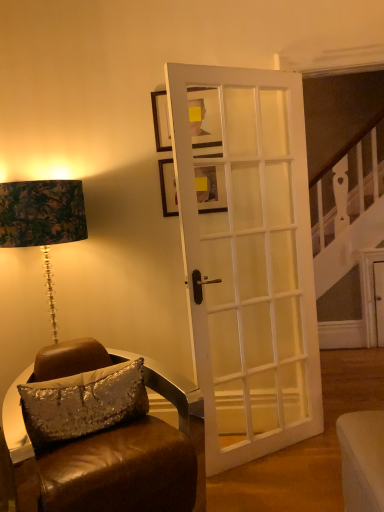
Question: Is matte black picture frame at upper center, placed as the second picture frame when sorted from bottom to top, surrounding brown leather chair at lower left?

Choices:
 (A) yes
 (B) no

Answer: (B)

Question: From the image's perspective, is matte black picture frame at upper center, marked as the first picture frame in a top-to-bottom arrangement, on top of brown leather chair at lower left?

Choices:
 (A) no
 (B) yes

Answer: (B)

Question: Is matte black picture frame at upper center, placed as the second picture frame when sorted from bottom to top, behind brown leather chair at lower left?

Choices:
 (A) no
 (B) yes

Answer: (B)

Question: Is matte black picture frame at upper center, placed as the second picture frame when sorted from bottom to top, in front of brown leather chair at lower left?

Choices:
 (A) no
 (B) yes

Answer: (A)

Question: Can you see matte black picture frame at upper center, marked as the first picture frame in a top-to-bottom arrangement, touching brown leather chair at lower left?

Choices:
 (A) no
 (B) yes

Answer: (A)

Question: Considering their positions, is matte black picture frame at upper center, marked as the first picture frame in a top-to-bottom arrangement, located in front of or behind silver sequined pillow at lower left?

Choices:
 (A) behind
 (B) front

Answer: (A)

Question: Which is correct: matte black picture frame at upper center, placed as the second picture frame when sorted from bottom to top, is inside silver sequined pillow at lower left, or outside of it?

Choices:
 (A) outside
 (B) inside

Answer: (A)

Question: From a real-world perspective, is matte black picture frame at upper center, marked as the first picture frame in a top-to-bottom arrangement, above or below silver sequined pillow at lower left?

Choices:
 (A) above
 (B) below

Answer: (A)

Question: In terms of width, does matte black picture frame at upper center, marked as the first picture frame in a top-to-bottom arrangement, look wider or thinner when compared to silver sequined pillow at lower left?

Choices:
 (A) wide
 (B) thin

Answer: (B)

Question: Does point (215, 208) appear closer or farther from the camera than point (284, 286)?

Choices:
 (A) farther
 (B) closer

Answer: (B)

Question: From a real-world perspective, relative to white glossy door at center, is wooden picture frame at center, which is the 2th picture frame in top-to-bottom order, vertically above or below?

Choices:
 (A) below
 (B) above

Answer: (B)

Question: Is wooden picture frame at center, which is the 2th picture frame in top-to-bottom order, inside or outside of white glossy door at center?

Choices:
 (A) outside
 (B) inside

Answer: (A)

Question: Is wooden picture frame at center, which is the 2th picture frame in top-to-bottom order, in front of or behind white glossy door at center in the image?

Choices:
 (A) behind
 (B) front

Answer: (A)

Question: In the image, is matte black picture frame at upper center, placed as the second picture frame when sorted from bottom to top, positioned in front of or behind white glossy door at center?

Choices:
 (A) behind
 (B) front

Answer: (A)

Question: From a real-world perspective, is matte black picture frame at upper center, marked as the first picture frame in a top-to-bottom arrangement, physically located above or below white glossy door at center?

Choices:
 (A) below
 (B) above

Answer: (B)